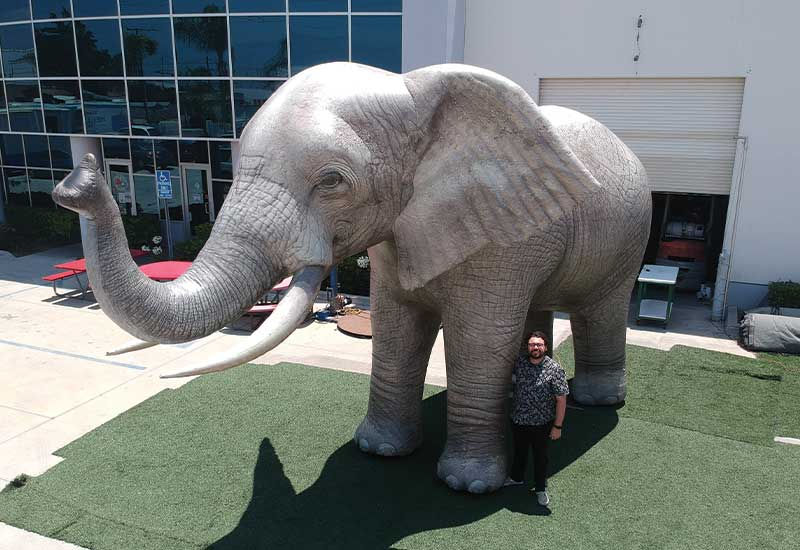
The width and height of the screenshot is (800, 550). In order to click on doors in this screenshot , I will do `click(200, 192)`, `click(121, 184)`.